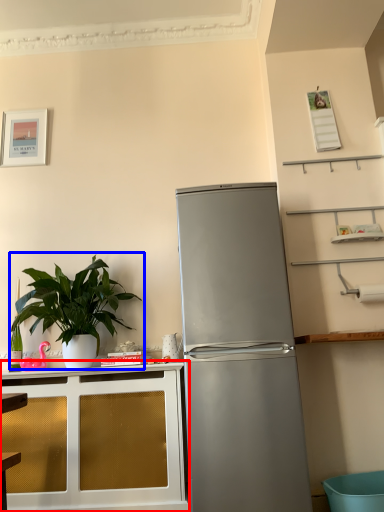
Question: Which point is further to the camera, cabinetry (highlighted by a red box) or houseplant (highlighted by a blue box)?

Choices:
 (A) cabinetry
 (B) houseplant

Answer: (B)